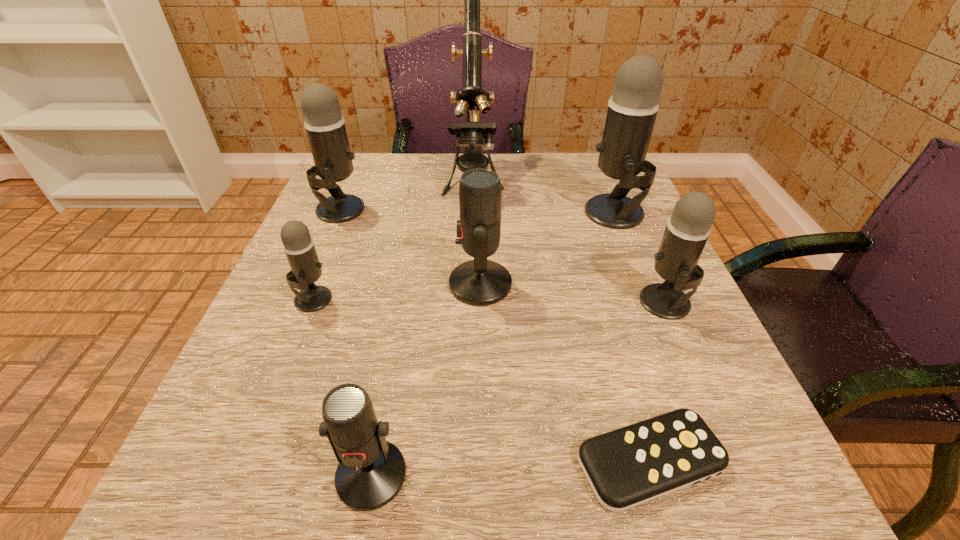
At what (x,y) coordinates should I click in order to perform the action: click on microscope. Please return your answer as a coordinate pair (x, y). Image resolution: width=960 pixels, height=540 pixels. Looking at the image, I should click on (472, 96).

Where is `the tallest microphone`? the tallest microphone is located at coordinates (632, 109).

At what (x,y) coordinates should I click in order to perform the action: click on the second tallest object. Please return your answer as a coordinate pair (x, y). This screenshot has width=960, height=540. Looking at the image, I should click on (632, 109).

At what (x,y) coordinates should I click in order to perform the action: click on the third smallest gray microphone. Please return your answer as a coordinate pair (x, y). Looking at the image, I should click on (325, 126).

Identify the location of the fifth shortest microphone. The image size is (960, 540). (325, 126).

Where is `the bigger red microphone`? The height and width of the screenshot is (540, 960). the bigger red microphone is located at coordinates (480, 282).

Where is `the right red microphone`? The width and height of the screenshot is (960, 540). the right red microphone is located at coordinates (480, 282).

This screenshot has width=960, height=540. What are the coordinates of `the third biggest gray microphone` in the screenshot? It's located at (687, 231).

Identify the location of the smallest gray microphone. (299, 247).

The image size is (960, 540). Find the location of `the smaller red microphone`. the smaller red microphone is located at coordinates (371, 471).